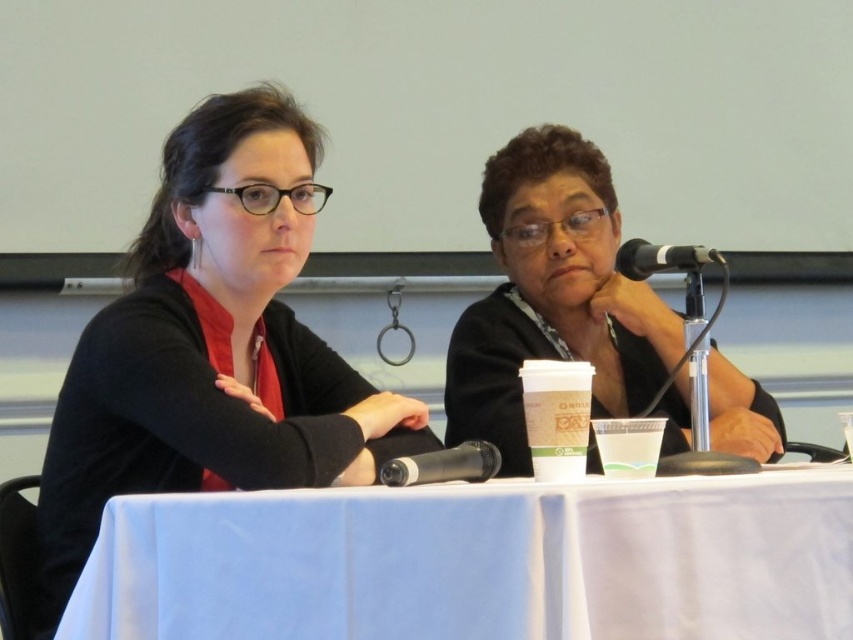
You are a photographer trying to place a small decoration at the point marked by coordinates point (213, 346). Based on the scene description, where exactly would this decoration be placed?

The point (213, 346) is on the matte black shirt at left, so the decoration would be placed on the matte black shirt at left.

You are a sound technician adjusting the microphone stand. The blue fabric table at center is where the speakers are placing their notes. To ensure the black plastic microphone at upper right is within easy reach for the speaker, should you move it closer or keep it as is?

The blue fabric table at center is 24.48 inches away from the black plastic microphone at upper right. Since 24.48 inches is approximately 2 feet, which is a comfortable distance for easy reach, the microphone at upper right can remain in its current position.